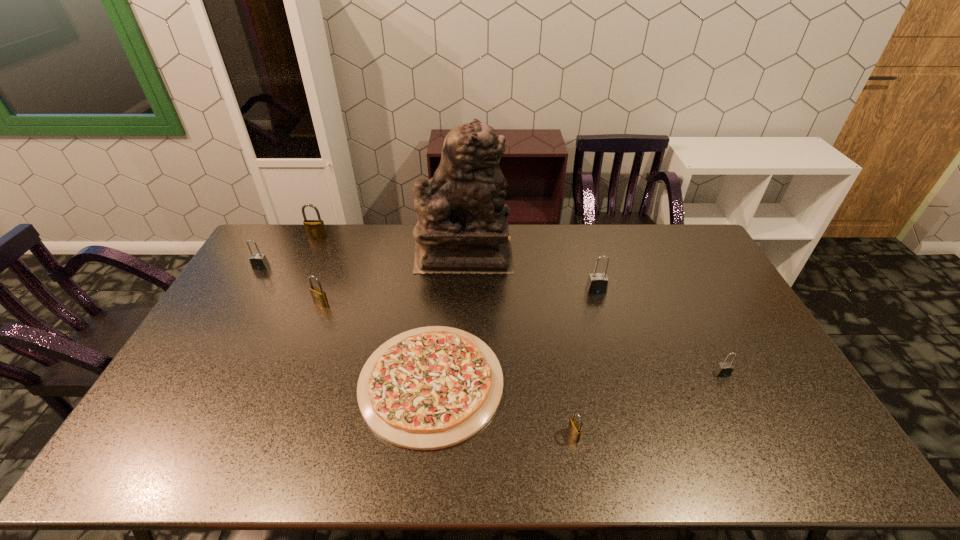
This screenshot has height=540, width=960. Find the location of `the second nearest padlock`. the second nearest padlock is located at coordinates (724, 369).

Identify the location of the nearest brass padlock. The height and width of the screenshot is (540, 960). (574, 428).

You are a GUI agent. You are given a task and a screenshot of the screen. Output one action in this format:
    pyautogui.click(x=<x>, y=<y>)
    Task: Click on the rightmost brass padlock
    
    Given the screenshot: What is the action you would take?
    pyautogui.click(x=574, y=428)

The height and width of the screenshot is (540, 960). I want to click on pizza, so click(x=429, y=388).

This screenshot has width=960, height=540. I want to click on free region located on the front-facing side of the sculpture, so click(595, 254).

Identify the location of vacant space located on the front of the leftmost brass padlock. This screenshot has height=540, width=960. (309, 255).

Identify the location of vacant space located 0.350m on the shackle of the second gray padlock from right to left. (622, 381).

Image resolution: width=960 pixels, height=540 pixels. In order to click on vacant region located 0.180m on the shackle of the leftmost padlock in this screenshot , I will do `click(239, 305)`.

You are a GUI agent. You are given a task and a screenshot of the screen. Output one action in this format:
    pyautogui.click(x=<x>, y=<y>)
    Task: Click on the free space located on the left of the fourth farthest padlock
    The width and height of the screenshot is (960, 540).
    Given the screenshot: What is the action you would take?
    pyautogui.click(x=276, y=303)

This screenshot has width=960, height=540. I want to click on vacant space located on the shackle of the rightmost padlock, so click(x=768, y=464).